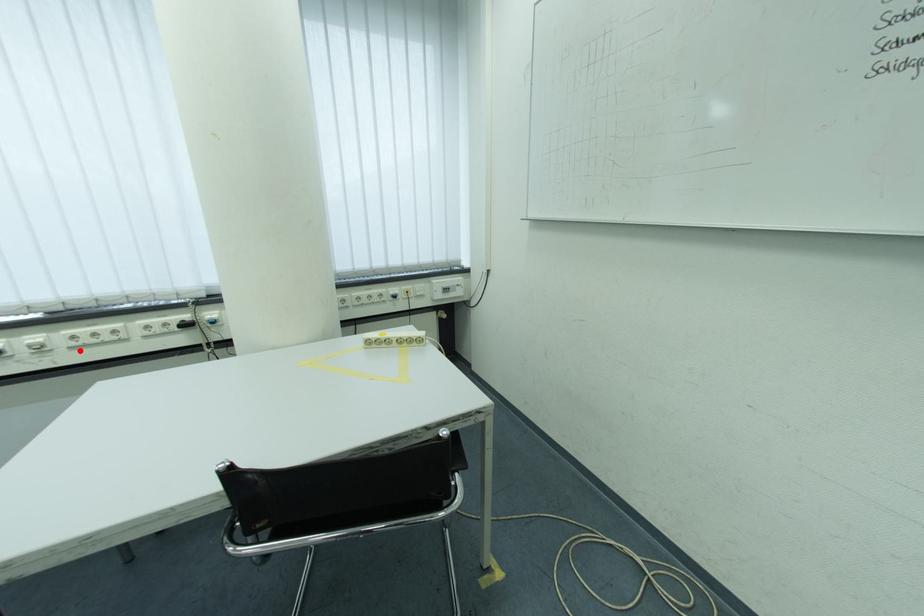
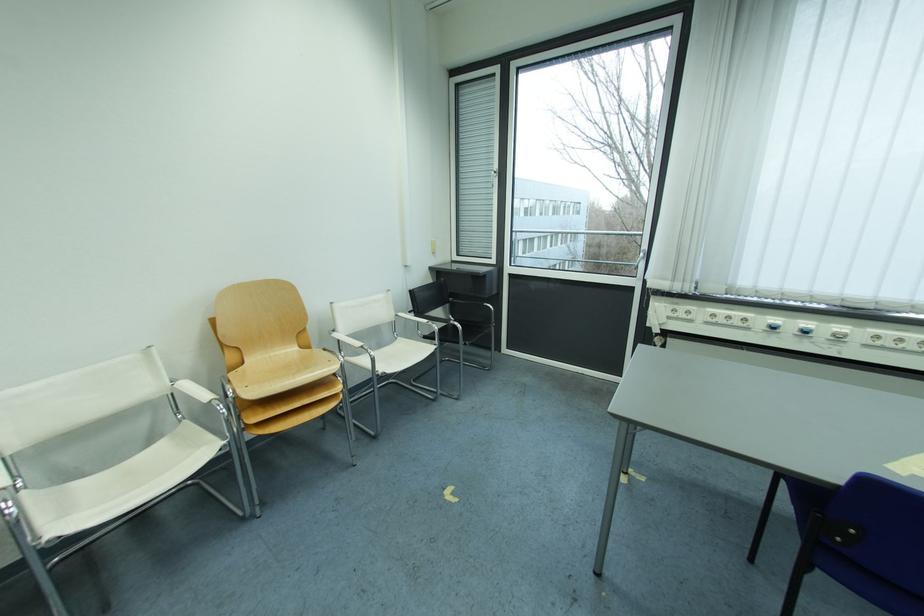
Where in the second image is the point corresponding to the highlighted location from the first image?

(874, 347)